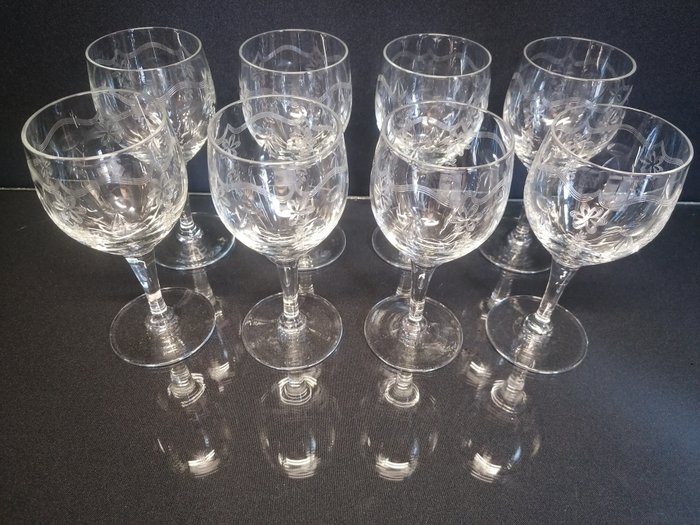
You are a GUI agent. You are given a task and a screenshot of the screen. Output one action in this format:
    pyautogui.click(x=<x>, y=<y>)
    Task: Click on the most appealing glass in my opinion
    This screenshot has height=525, width=700.
    Given the screenshot: What is the action you would take?
    pyautogui.click(x=274, y=171)